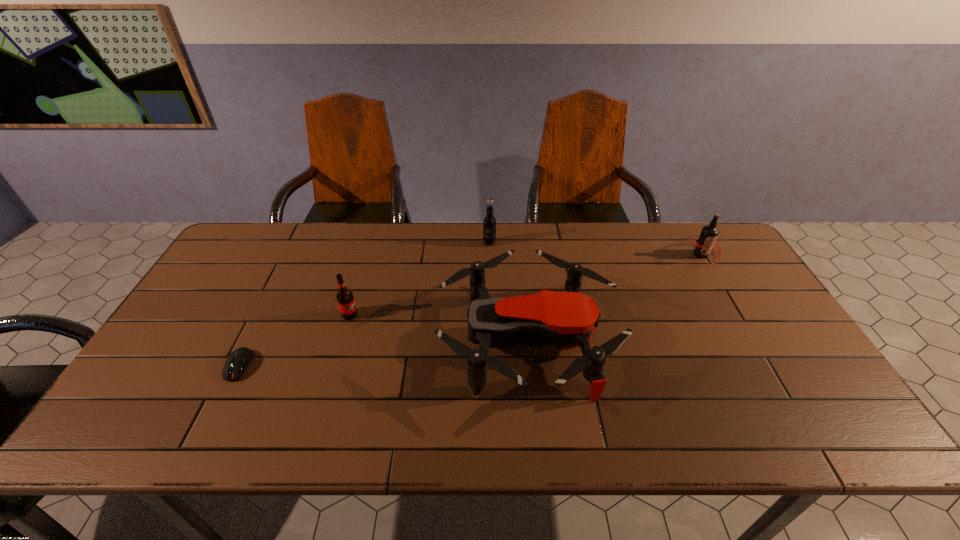
The image size is (960, 540). I want to click on free space at the right edge of the desktop, so click(x=744, y=294).

Where is `vacant space that's between the nearest root beer and the leftmost object`? This screenshot has width=960, height=540. vacant space that's between the nearest root beer and the leftmost object is located at coordinates (295, 340).

At what (x,y) coordinates should I click in order to perform the action: click on free space between the nearest root beer and the rightmost root beer. Please return your answer as a coordinate pair (x, y). Looking at the image, I should click on (525, 285).

Locate an element on the screen. This screenshot has height=540, width=960. vacant area that lies between the second object from left to right and the second root beer from right to left is located at coordinates (420, 279).

The width and height of the screenshot is (960, 540). What are the coordinates of `vacant area that lies between the second root beer from right to left and the rightmost object` in the screenshot? It's located at (595, 248).

This screenshot has height=540, width=960. In order to click on vacant space in between the second object from left to right and the rightmost root beer in this screenshot , I will do `click(525, 285)`.

Find the location of a particular element. unoccupied position between the drone and the rightmost object is located at coordinates (614, 298).

What are the coordinates of `vacant area that lies between the nearest root beer and the second root beer from right to left` in the screenshot? It's located at (420, 279).

You are a GUI agent. You are given a task and a screenshot of the screen. Output one action in this format:
    pyautogui.click(x=<x>, y=<y>)
    Task: Click on the free point between the drone and the rightmost object
    The height and width of the screenshot is (540, 960).
    Given the screenshot: What is the action you would take?
    pyautogui.click(x=614, y=298)

You are a GUI agent. You are given a task and a screenshot of the screen. Output one action in this format:
    pyautogui.click(x=<x>, y=<y>)
    Task: Click on the free space that is in between the rightmost root beer and the second root beer from right to left
    Image resolution: width=960 pixels, height=540 pixels.
    Given the screenshot: What is the action you would take?
    pyautogui.click(x=595, y=248)